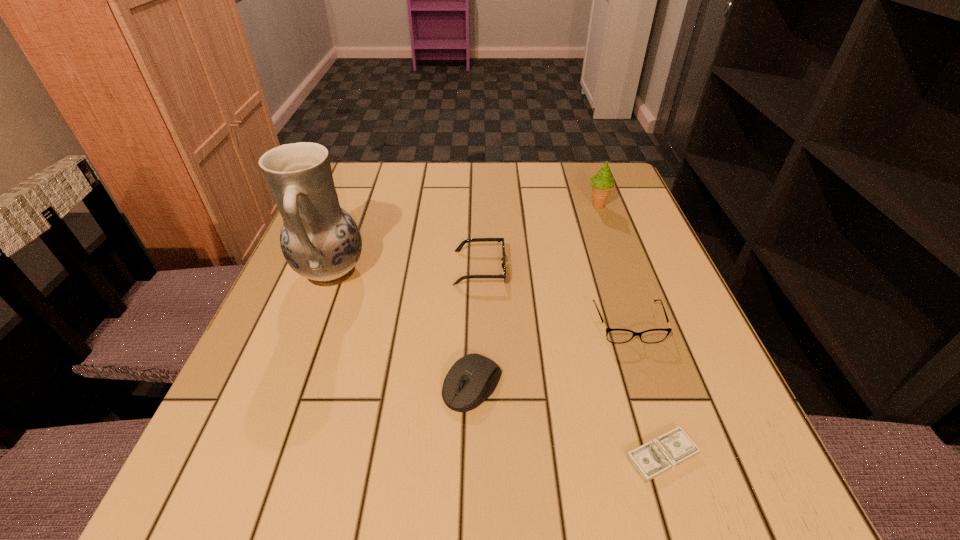
At what (x,y) coordinates should I click in order to perform the action: click on vacant area that lies between the farthest object and the spectacles. Please return your answer as a coordinate pair (x, y). The height and width of the screenshot is (540, 960). Looking at the image, I should click on (612, 265).

Locate an element on the screen. free area in between the fifth farthest object and the pottery is located at coordinates (401, 329).

You are a GUI agent. You are given a task and a screenshot of the screen. Output one action in this format:
    pyautogui.click(x=<x>, y=<y>)
    Task: Click on the vacant space that is in between the sunglasses and the spectacles
    The width and height of the screenshot is (960, 540).
    Given the screenshot: What is the action you would take?
    pyautogui.click(x=554, y=296)

I want to click on vacant region between the icecream and the spectacles, so click(x=612, y=265).

Find the location of a particular element. vacant space in between the computer equipment and the spectacles is located at coordinates (550, 355).

You are a GUI agent. You are given a task and a screenshot of the screen. Output one action in this format:
    pyautogui.click(x=<x>, y=<y>)
    Task: Click on the vacant area between the spectacles and the second nearest object
    The image size is (960, 540).
    Given the screenshot: What is the action you would take?
    pyautogui.click(x=550, y=355)

Locate an element on the screen. The image size is (960, 540). blank region between the sunglasses and the money is located at coordinates (571, 362).

This screenshot has height=540, width=960. I want to click on vacant area that lies between the tallest object and the shortest object, so click(496, 364).

At what (x,y) coordinates should I click in order to perform the action: click on free space between the second tallest object and the sunglasses. Please return your answer as a coordinate pair (x, y). This screenshot has width=960, height=540. Looking at the image, I should click on (539, 237).

This screenshot has height=540, width=960. Find the location of `blank region between the computer equipment and the icecream`. blank region between the computer equipment and the icecream is located at coordinates tap(536, 295).